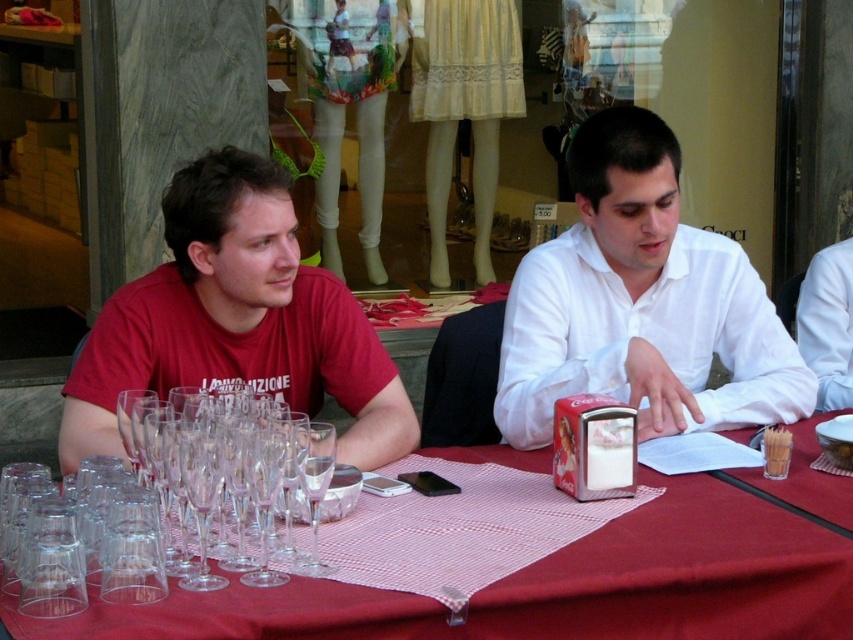
Who is higher up, red fabric tablecloth at center or matte red t-shirt at left?

matte red t-shirt at left is above.

Is red fabric tablecloth at center below matte red t-shirt at left?

Yes, red fabric tablecloth at center is below matte red t-shirt at left.

Describe the element at coordinates (550, 588) in the screenshot. I see `red fabric tablecloth at center` at that location.

The height and width of the screenshot is (640, 853). Identify the location of red fabric tablecloth at center. (550, 588).

In the scene shown: Who is more distant from viewer, (554, 634) or (682, 365)?

The point (682, 365) is behind.

Can you confirm if red fabric tablecloth at center is thinner than white smooth shirt at center?

Incorrect, red fabric tablecloth at center's width is not less than white smooth shirt at center's.

Describe the element at coordinates (550, 588) in the screenshot. This screenshot has width=853, height=640. I see `red fabric tablecloth at center` at that location.

You are a GUI agent. You are given a task and a screenshot of the screen. Output one action in this format:
    pyautogui.click(x=<x>, y=<y>)
    Task: Click on the red fabric tablecloth at center
    
    Given the screenshot: What is the action you would take?
    pyautogui.click(x=550, y=588)

Does white smooth shirt at center appear on the left side of matte red t-shirt at left?

Incorrect, white smooth shirt at center is not on the left side of matte red t-shirt at left.

Is white smooth shirt at center smaller than matte red t-shirt at left?

Incorrect, white smooth shirt at center is not smaller in size than matte red t-shirt at left.

Locate an element on the screen. white smooth shirt at center is located at coordinates (641, 304).

Identify the location of white smooth shirt at center. Image resolution: width=853 pixels, height=640 pixels. (641, 304).